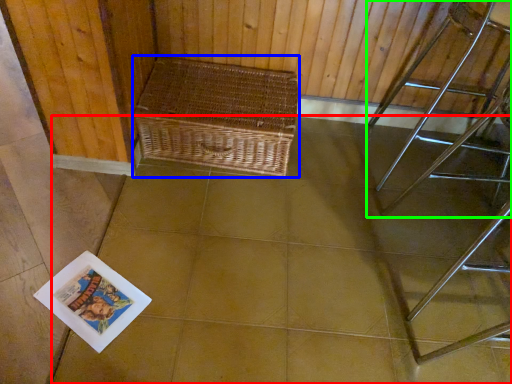
Question: Based on their relative distances, which object is farther from square (highlighted by a red box)? Choose from picnic basket (highlighted by a blue box) and furniture (highlighted by a green box).

Choices:
 (A) picnic basket
 (B) furniture

Answer: (B)